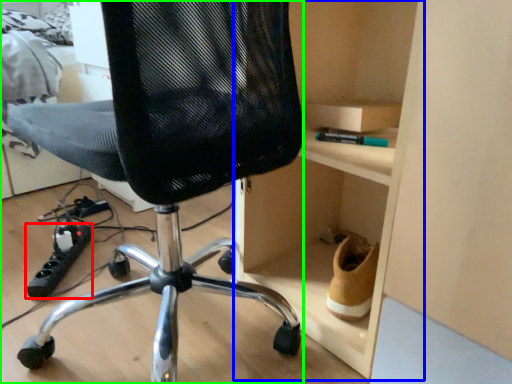
Question: Estimate the real-world distances between objects in this image. Which object is closer to equipment (highlighted by a red box), cabinet (highlighted by a blue box) or chair (highlighted by a green box)?

Choices:
 (A) cabinet
 (B) chair

Answer: (B)